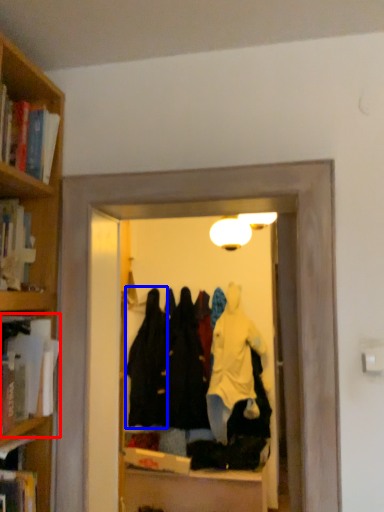
Question: Which point is further to the camera, book (highlighted by a red box) or clothing (highlighted by a blue box)?

Choices:
 (A) book
 (B) clothing

Answer: (B)